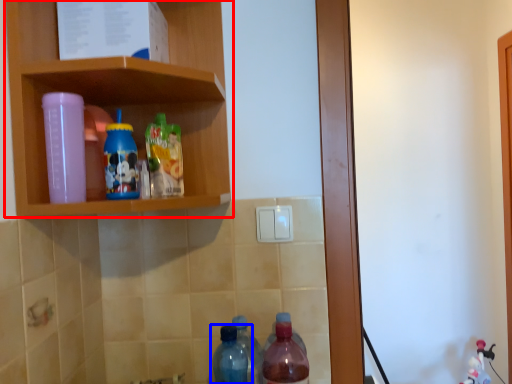
Question: Which object is closer to the camera taking this photo, shelf (highlighted by a red box) or bottle (highlighted by a blue box)?

Choices:
 (A) shelf
 (B) bottle

Answer: (A)